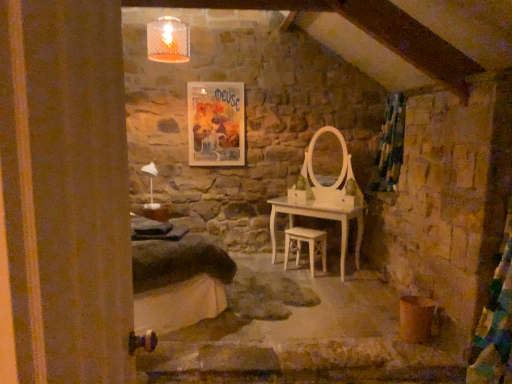
Measure the distance between point (152, 167) and camera.

The distance of point (152, 167) from camera is 16.65 feet.

This screenshot has width=512, height=384. What do you see at coordinates (151, 184) in the screenshot? I see `white glossy table lamp at left` at bounding box center [151, 184].

Identify the location of green fabric curtain at right. (390, 147).

Find the location of a particular element. This screenshot has height=384, width=512. matte paper poster at upper center is located at coordinates (216, 123).

At what (x,y) coordinates should I click in order to perform the action: click on picture frame lying above the white wooden stool at center (from the image's perspective). Please return your answer as a coordinate pair (x, y). This screenshot has height=384, width=512. Looking at the image, I should click on (216, 123).

Is white wooden stool at center positioned far away from matte paper poster at upper center?

Indeed, white wooden stool at center is not near matte paper poster at upper center.

Which object is thinner, white wooden stool at center or matte paper poster at upper center?

With smaller width is matte paper poster at upper center.

Would you consider matte paper poster at upper center to be distant from white wooden stool at center?

Yes, matte paper poster at upper center and white wooden stool at center are quite far apart.

Could you tell me if matte paper poster at upper center is turned towards white wooden stool at center?

No, matte paper poster at upper center is not oriented towards white wooden stool at center.

Is matte paper poster at upper center completely or partially outside of white wooden stool at center?

matte paper poster at upper center lies outside white wooden stool at center's area.

Between point (322, 253) and point (395, 142), which one is positioned in front?

The point (395, 142) is closer to the camera.

At what (x,y) coordinates should I click in order to perform the action: click on curtain that appears behind the white wooden stool at center. Please return your answer as a coordinate pair (x, y). This screenshot has width=512, height=384. Looking at the image, I should click on (390, 147).

From a real-world perspective, is white wooden stool at center physically located above or below green fabric curtain at right?

Clearly, from a real-world perspective, white wooden stool at center is below green fabric curtain at right.

From the image's perspective, which is below, white wooden stool at center or green fabric curtain at right?

From the image's view, white wooden stool at center is below.

From a real-world perspective, who is located lower, green fabric curtain at right or white wooden stool at center?

In real-world perspective, white wooden stool at center is lower.

Based on their positions, is green fabric curtain at right located to the left or right of white wooden stool at center?

Based on their positions, green fabric curtain at right is located to the right of white wooden stool at center.

Can you confirm if green fabric curtain at right is thinner than white wooden stool at center?

No, green fabric curtain at right is not thinner than white wooden stool at center.

Is green fabric curtain at right facing away from white wooden stool at center?

That's not correct — green fabric curtain at right is not looking away from white wooden stool at center.

Would you say white wooden stool at center is a long distance from white glossy table lamp at left?

Indeed, white wooden stool at center is not near white glossy table lamp at left.

Can you confirm if white wooden stool at center is taller than white glossy table lamp at left?

Incorrect, the height of white wooden stool at center is not larger of that of white glossy table lamp at left.

Visually, is white wooden stool at center positioned to the left or to the right of white glossy table lamp at left?

In the image, white wooden stool at center appears on the right side of white glossy table lamp at left.

From the image's perspective, is white wooden stool at center located above white glossy table lamp at left?

No, from the image's perspective, white wooden stool at center is not on top of white glossy table lamp at left.

Consider the image. Which object is closer to the camera taking this photo, white glossy table lamp at left or green fabric curtain at right?

white glossy table lamp at left.

This screenshot has height=384, width=512. Identify the location of table lamp beneath the green fabric curtain at right (from a real-world perspective). (151, 184).

From a real-world perspective, which is physically below, white glossy table lamp at left or green fabric curtain at right?

white glossy table lamp at left, from a real-world perspective.

Between white glossy table lamp at left and green fabric curtain at right, which one has less height?

white glossy table lamp at left.

Considering the positions of points (200, 157) and (153, 163), is point (200, 157) farther from camera compared to point (153, 163)?

Yes, point (200, 157) is farther from viewer.

From a real-world perspective, who is located lower, matte paper poster at upper center or white glossy table lamp at left?

From a 3D spatial view, white glossy table lamp at left is below.

What are the coordinates of `picture frame behind the white glossy table lamp at left` in the screenshot? It's located at (216, 123).

Considering the relative sizes of matte paper poster at upper center and white glossy table lamp at left in the image provided, is matte paper poster at upper center thinner than white glossy table lamp at left?

Indeed, matte paper poster at upper center has a lesser width compared to white glossy table lamp at left.

The width and height of the screenshot is (512, 384). I want to click on picture frame above the white wooden stool at center (from a real-world perspective), so click(216, 123).

The height and width of the screenshot is (384, 512). In order to click on picture frame behind the white wooden stool at center in this screenshot , I will do `click(216, 123)`.

When comparing their distances from white glossy table lamp at left, does matte paper poster at upper center or white wooden stool at center seem further?

white wooden stool at center is further to white glossy table lamp at left.

Which object lies nearer to the anchor point green fabric curtain at right, matte paper poster at upper center or white glossy table lamp at left?

matte paper poster at upper center.

Looking at the image, which one is located closer to white wooden stool at center, matte paper poster at upper center or green fabric curtain at right?

The object closer to white wooden stool at center is green fabric curtain at right.

From the image, which object appears to be nearer to green fabric curtain at right, white glossy table lamp at left or matte paper poster at upper center?

matte paper poster at upper center.

Looking at the image, which one is located further to green fabric curtain at right, white wooden stool at center or white glossy table lamp at left?

white glossy table lamp at left is further to green fabric curtain at right.

Estimate the real-world distances between objects in this image. Which object is further from green fabric curtain at right, white glossy table lamp at left or white wooden stool at center?

white glossy table lamp at left is positioned further to the anchor green fabric curtain at right.

Based on their spatial positions, is matte paper poster at upper center or white wooden stool at center further from green fabric curtain at right?

matte paper poster at upper center.

Based on their spatial positions, is green fabric curtain at right or matte paper poster at upper center closer to white wooden stool at center?

green fabric curtain at right.

Identify the location of stool between matte paper poster at upper center and green fabric curtain at right in the horizontal direction. (308, 245).

At what (x,y) coordinates should I click in order to perform the action: click on stool between white glossy table lamp at left and green fabric curtain at right in the horizontal direction. Please return your answer as a coordinate pair (x, y). Image resolution: width=512 pixels, height=384 pixels. Looking at the image, I should click on (308, 245).

Find the location of `picture frame between white glossy table lamp at left and white wooden stool at center in the horizontal direction`. picture frame between white glossy table lamp at left and white wooden stool at center in the horizontal direction is located at coordinates (x=216, y=123).

Image resolution: width=512 pixels, height=384 pixels. I want to click on picture frame between white glossy table lamp at left and green fabric curtain at right from left to right, so click(216, 123).